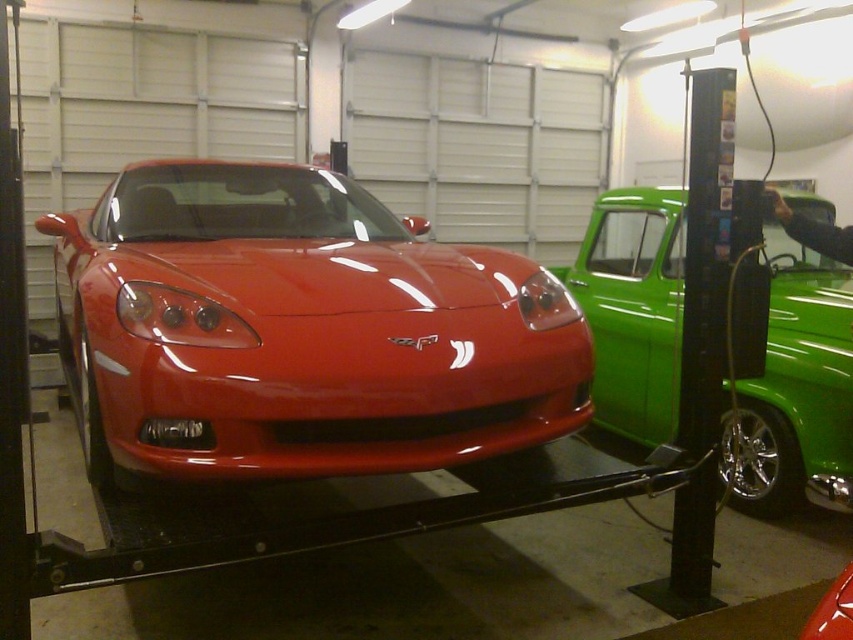
Question: Is glossy red sports car at center thinner than green glossy pickup truck at right?

Choices:
 (A) no
 (B) yes

Answer: (A)

Question: Considering the relative positions of glossy red sports car at center and green glossy pickup truck at right in the image provided, where is glossy red sports car at center located with respect to green glossy pickup truck at right?

Choices:
 (A) right
 (B) left

Answer: (B)

Question: Which point is farther from the camera taking this photo?

Choices:
 (A) (601, 339)
 (B) (302, 164)

Answer: (A)

Question: Is glossy red sports car at center thinner than green glossy pickup truck at right?

Choices:
 (A) yes
 (B) no

Answer: (B)

Question: Which point is closer to the camera?

Choices:
 (A) green glossy pickup truck at right
 (B) glossy red sports car at center

Answer: (B)